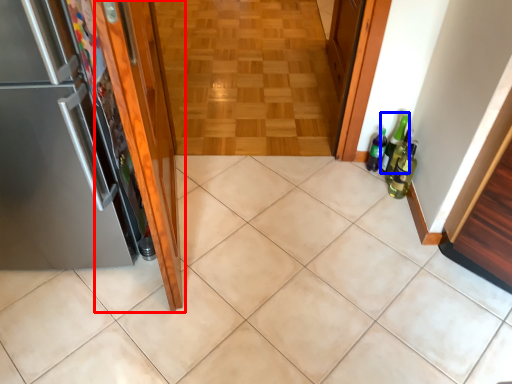
Question: Which point is further to the camera, door (highlighted by a red box) or beer bottle (highlighted by a blue box)?

Choices:
 (A) door
 (B) beer bottle

Answer: (B)